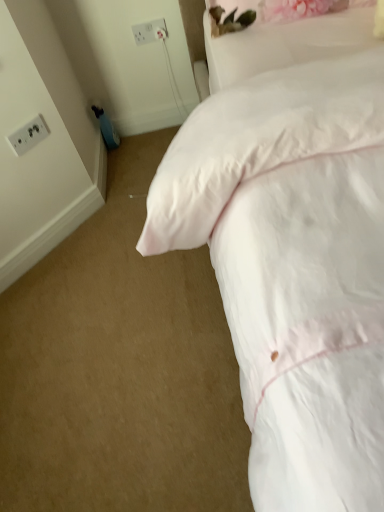
Question: From a real-world perspective, is white plastic socket at upper left, positioned as the first electric outlet in top-to-bottom order, positioned under white satin pillow at upper right based on gravity?

Choices:
 (A) no
 (B) yes

Answer: (B)

Question: Is white plastic socket at upper left, the first electric outlet positioned from the right, far from white satin pillow at upper right?

Choices:
 (A) yes
 (B) no

Answer: (B)

Question: Is white plastic socket at upper left, positioned as the first electric outlet in top-to-bottom order, at the left side of white satin pillow at upper right?

Choices:
 (A) no
 (B) yes

Answer: (B)

Question: Can you confirm if white plastic socket at upper left, positioned as the first electric outlet in top-to-bottom order, is smaller than white satin pillow at upper right?

Choices:
 (A) yes
 (B) no

Answer: (A)

Question: Does white plastic socket at upper left, which is counted as the 2th electric outlet, starting from the left, have a lesser height compared to white satin pillow at upper right?

Choices:
 (A) no
 (B) yes

Answer: (B)

Question: Is white plastic socket at upper left, the 2th electric outlet when ordered from bottom to top, at the right side of white satin pillow at upper right?

Choices:
 (A) yes
 (B) no

Answer: (B)

Question: Is white plastic socket at upper left, which is counted as the 2th electric outlet, starting from the left, facing away from white soft bed at upper right?

Choices:
 (A) no
 (B) yes

Answer: (A)

Question: Is white plastic socket at upper left, arranged as the 2th electric outlet when viewed from the front, oriented towards white soft bed at upper right?

Choices:
 (A) yes
 (B) no

Answer: (A)

Question: Can you confirm if white plastic socket at upper left, positioned as the first electric outlet in top-to-bottom order, is thinner than white soft bed at upper right?

Choices:
 (A) yes
 (B) no

Answer: (A)

Question: Does white plastic socket at upper left, the first electric outlet positioned from the right, appear on the right side of white soft bed at upper right?

Choices:
 (A) yes
 (B) no

Answer: (B)

Question: From the image's perspective, would you say white plastic socket at upper left, the first electric outlet positioned from the right, is shown under white soft bed at upper right?

Choices:
 (A) no
 (B) yes

Answer: (A)

Question: Is white plastic socket at upper left, the 2th electric outlet when ordered from bottom to top, positioned far away from white soft bed at upper right?

Choices:
 (A) yes
 (B) no

Answer: (A)

Question: Can you confirm if white plastic electrical outlet at upper left, arranged as the first electric outlet when viewed from the left, is smaller than white satin pillow at upper right?

Choices:
 (A) no
 (B) yes

Answer: (B)